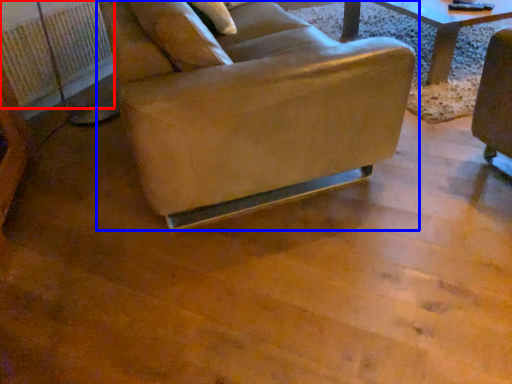
Question: Which object appears closest to the camera in this image, radiator (highlighted by a red box) or chair (highlighted by a blue box)?

Choices:
 (A) radiator
 (B) chair

Answer: (B)